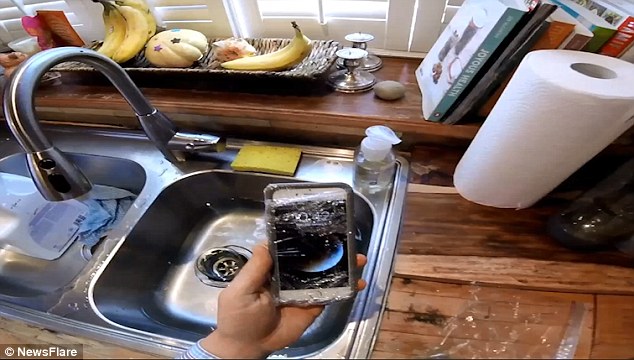
This screenshot has height=360, width=634. Find the location of `sink`. sink is located at coordinates (241, 226).